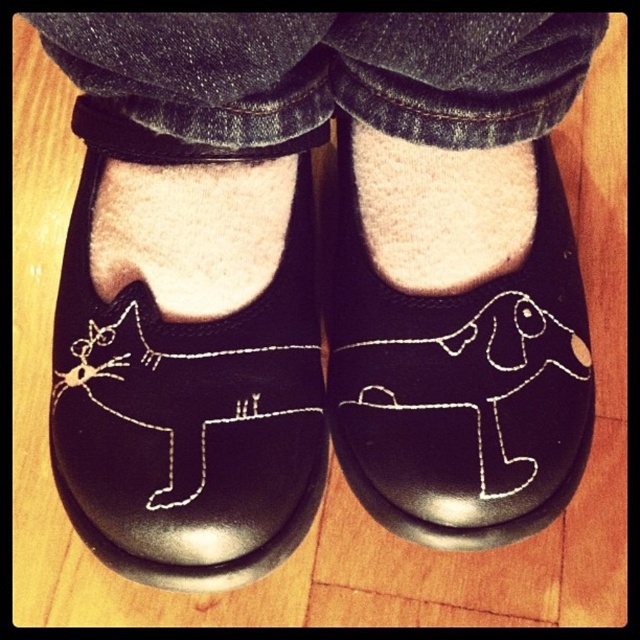
Is point (156, 556) positioned before point (486, 260)?

Yes, it is in front of point (486, 260).

Does black leather cat at center lie behind white fluffy sock at center?

No, black leather cat at center is in front of white fluffy sock at center.

The image size is (640, 640). Describe the element at coordinates (186, 396) in the screenshot. I see `black leather cat at center` at that location.

Where is `black leather cat at center`? black leather cat at center is located at coordinates (186, 396).

Does point (164, 416) come behind point (470, 358)?

No.

This screenshot has height=640, width=640. In order to click on black leather cat at center in this screenshot , I will do `click(186, 396)`.

The image size is (640, 640). Identify the location of black leather cat at center. (186, 396).

Who is lower down, black leather dog at center or white fluffy sock at center?

black leather dog at center

I want to click on black leather dog at center, so click(x=460, y=381).